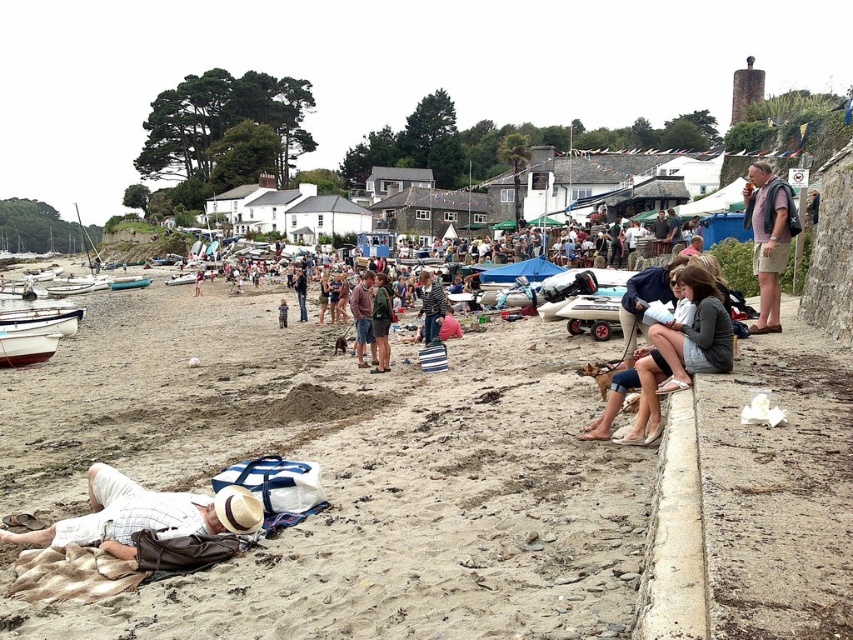
Who is more forward, (x=167, y=532) or (x=363, y=278)?

Positioned in front is point (x=167, y=532).

Is white cotton shirt at lower left thinner than brown cotton shirt at center?

No, white cotton shirt at lower left is not thinner than brown cotton shirt at center.

Locate an element on the screen. white cotton shirt at lower left is located at coordinates (144, 515).

This screenshot has width=853, height=640. Identify the location of white cotton shirt at lower left. (144, 515).

From the picture: Does white cotton shirt at lower left come in front of matte gray sweater at center?

Yes, it is.

Between point (94, 531) and point (618, 412), which one is positioned behind?

Point (618, 412)

At what (x,y) coordinates should I click in order to perform the action: click on white cotton shirt at lower left. Please return your answer as a coordinate pair (x, y). Looking at the image, I should click on (144, 515).

Can you confirm if white cotton shirt at lower left is positioned below denim shorts at center?

Yes, white cotton shirt at lower left is below denim shorts at center.

Is white cotton shirt at lower left smaller than denim shorts at center?

Yes.

You are a GUI agent. You are given a task and a screenshot of the screen. Output one action in this format:
    pyautogui.click(x=<x>, y=<y>)
    Task: Click on the white cotton shirt at lower left
    
    Given the screenshot: What is the action you would take?
    pyautogui.click(x=144, y=515)